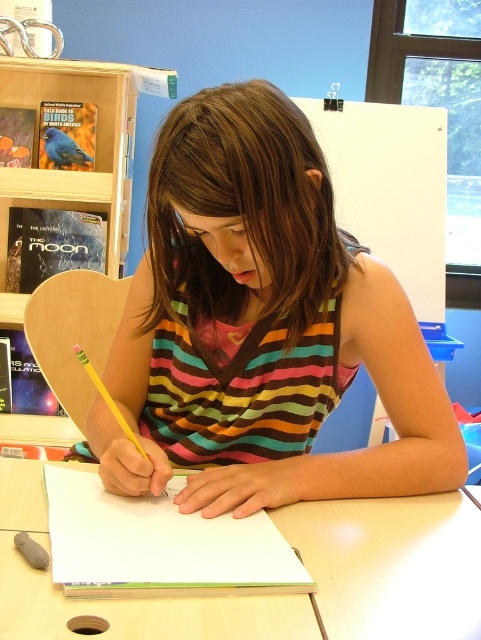
Question: Does white matte table at center have a larger size compared to wooden bookshelf at upper left?

Choices:
 (A) no
 (B) yes

Answer: (A)

Question: Does white matte table at center appear on the right side of wooden bookshelf at upper left?

Choices:
 (A) no
 (B) yes

Answer: (B)

Question: Considering the real-world distances, which object is closest to the striped fabric shirt at center?

Choices:
 (A) wooden bookshelf at upper left
 (B) white matte table at center

Answer: (B)

Question: Which of the following is the closest to the observer?

Choices:
 (A) wooden bookshelf at upper left
 (B) striped fabric shirt at center
 (C) white matte table at center

Answer: (C)

Question: Which of these objects is positioned closest to the striped fabric shirt at center?

Choices:
 (A) white matte table at center
 (B) wooden bookshelf at upper left

Answer: (A)

Question: From the image, what is the correct spatial relationship of striped fabric shirt at center in relation to wooden bookshelf at upper left?

Choices:
 (A) left
 (B) right

Answer: (B)